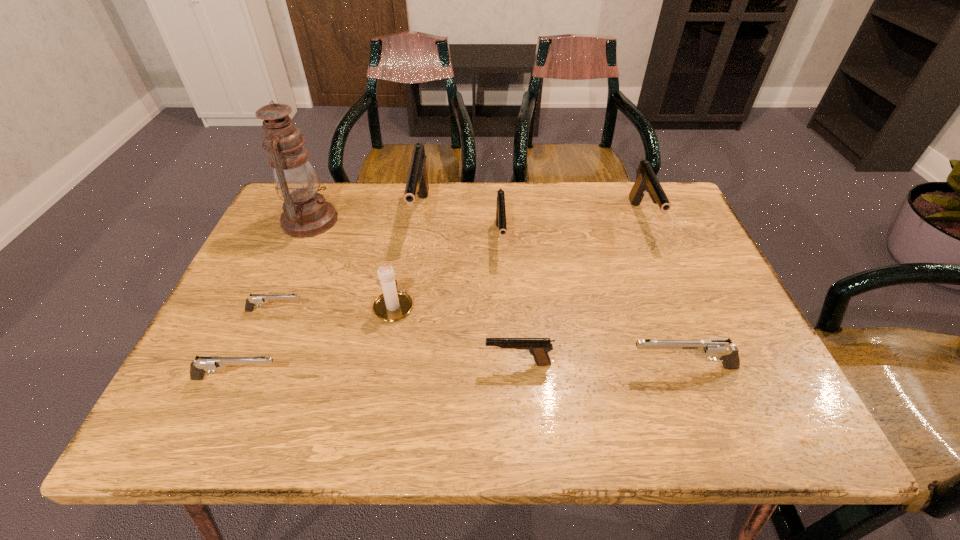
Image resolution: width=960 pixels, height=540 pixels. In order to click on the smallest black pistol in this screenshot , I will do `click(538, 347)`.

At what (x,y) coordinates should I click in order to perform the action: click on the nearest silver pistol. Please return your answer as a coordinate pair (x, y). Looking at the image, I should click on (203, 364).

The height and width of the screenshot is (540, 960). Identify the location of the nearest pistol. (203, 364).

I want to click on the shortest object, so click(251, 301).

This screenshot has width=960, height=540. I want to click on the farthest silver pistol, so 251,301.

Find the location of a particular element. The height and width of the screenshot is (540, 960). free location located on the right of the oil lamp is located at coordinates coord(401,220).

The width and height of the screenshot is (960, 540). Identify the location of blank space located at the muzzle of the biggest black pistol. (403, 325).

Identify the location of free space located at the muzzle of the second tallest pistol. The height and width of the screenshot is (540, 960). (697, 348).

In order to click on free space located 0.160m on the handle side of the candle holder in this screenshot , I will do `click(405, 245)`.

You are a GUI agent. You are given a task and a screenshot of the screen. Output one action in this format:
    pyautogui.click(x=<x>, y=<y>)
    Task: Click on the free space located on the handle side of the candle holder
    The width and height of the screenshot is (960, 540).
    Given the screenshot: What is the action you would take?
    pyautogui.click(x=407, y=235)